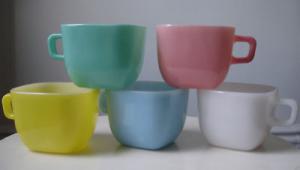
You are a GUI agent. You are given a task and a screenshot of the screen. Output one action in this format:
    pyautogui.click(x=<x>, y=<y>)
    Task: Click on the shadows of the cups
    
    Given the screenshot: What is the action you would take?
    pyautogui.click(x=278, y=142), pyautogui.click(x=190, y=142), pyautogui.click(x=105, y=143)